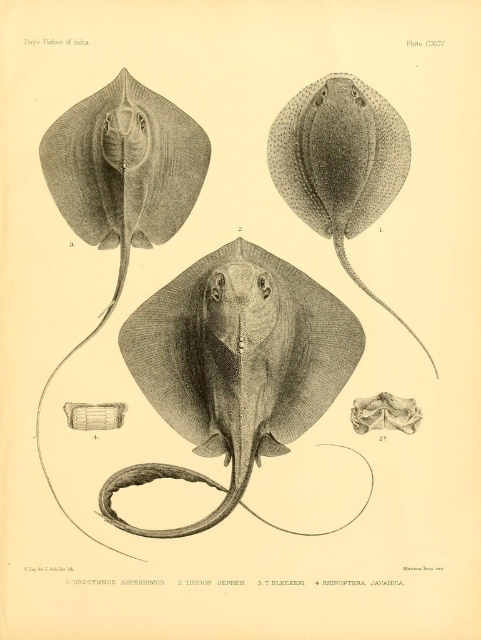
In the illustration from the scientific publication, there are two stingrays labeled as gray textured stingray at upper left and smooth gray stingray at center. Which of these two stingrays is positioned to the right side of the other?

The smooth gray stingray at center is positioned to the right of the gray textured stingray at upper left.

Based on the illustration from the scientific publication, where is the gray textured stingray at center located in terms of its 2D coordinates?

The gray textured stingray at center is located at the 2D coordinates point (240, 352).